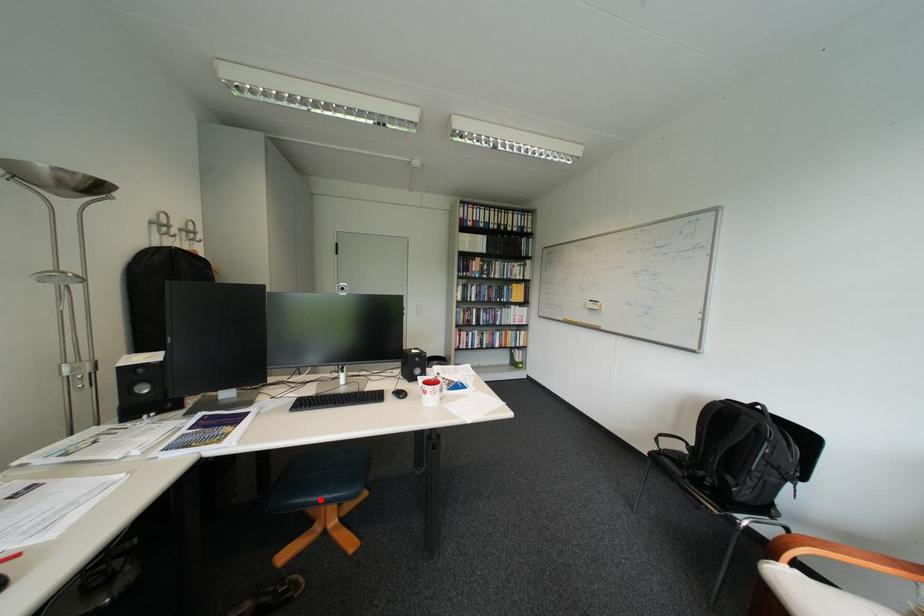
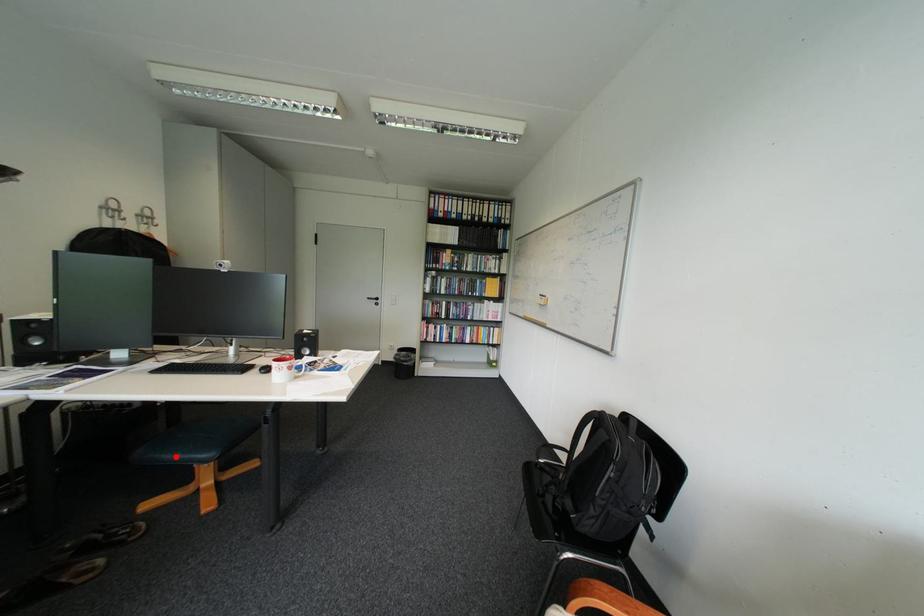
I am providing you with two images of the same scene from different viewpoints. A red point is marked on the first image and another point is marked on the second image. Is the red point in image1 aligned with the point shown in image2?

Yes